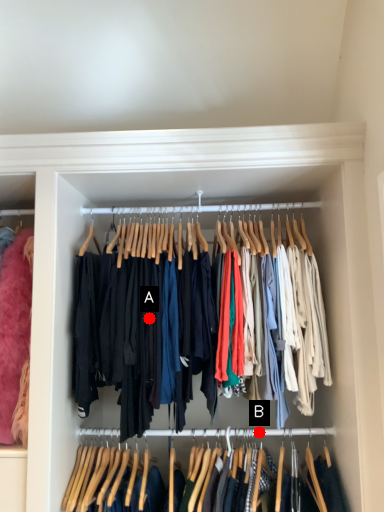
Question: Two points are circled on the image, labeled by A and B beside each circle. Which of the following is the farthest from the observer?

Choices:
 (A) A is further
 (B) B is further

Answer: (B)